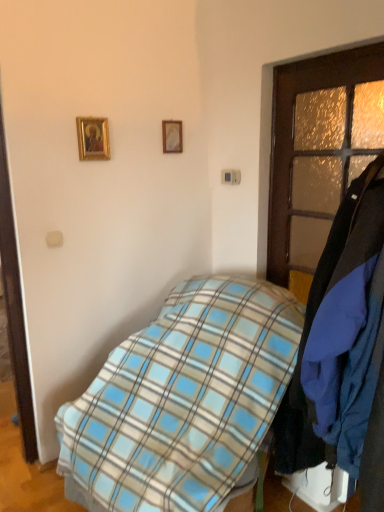
What do you see at coordinates (172, 136) in the screenshot? This screenshot has height=512, width=384. I see `gold-framed picture at upper center, the second picture frame when ordered from left to right` at bounding box center [172, 136].

What do you see at coordinates (93, 138) in the screenshot? I see `gold-framed picture at upper left, arranged as the 2th picture frame when viewed from the right` at bounding box center [93, 138].

This screenshot has height=512, width=384. I want to click on brown wooden door at right, so click(x=319, y=152).

How different are the orientations of gold-framed picture at upper center, the 2th picture frame when ordered from front to back, and brown wooden door at right in degrees?

The angular difference between gold-framed picture at upper center, the 2th picture frame when ordered from front to back, and brown wooden door at right is 91 degrees.

Is gold-framed picture at upper center, the second picture frame when ordered from left to right, inside or outside of brown wooden door at right?

gold-framed picture at upper center, the second picture frame when ordered from left to right, is spatially situated outside brown wooden door at right.

Considering the sizes of gold-framed picture at upper center, placed as the 1th picture frame when sorted from right to left, and brown wooden door at right in the image, is gold-framed picture at upper center, placed as the 1th picture frame when sorted from right to left, taller or shorter than brown wooden door at right?

gold-framed picture at upper center, placed as the 1th picture frame when sorted from right to left, is shorter than brown wooden door at right.

Which of these two, gold-framed picture at upper left, arranged as the 2th picture frame when viewed from the right, or blue plaid blanket at center, stands taller?

Standing taller between the two is blue plaid blanket at center.

Is gold-framed picture at upper left, the second picture frame positioned from the back, at the left side of blue plaid blanket at center?

Yes.

From a real-world perspective, is gold-framed picture at upper left, arranged as the 2th picture frame when viewed from the right, physically located above or below blue plaid blanket at center?

gold-framed picture at upper left, arranged as the 2th picture frame when viewed from the right, is situated higher than blue plaid blanket at center in the real world.

In the scene shown: Is the position of gold-framed picture at upper left, the first picture frame in the left-to-right sequence, less distant than that of blue plaid blanket at center?

No, it is not.

From the picture: How far apart are brown wooden door at right and gold-framed picture at upper center, which is the first picture frame in back-to-front order?

brown wooden door at right is 31.39 inches from gold-framed picture at upper center, which is the first picture frame in back-to-front order.

From a real-world perspective, who is located higher, brown wooden door at right or gold-framed picture at upper center, placed as the 1th picture frame when sorted from right to left?

gold-framed picture at upper center, placed as the 1th picture frame when sorted from right to left, is physically above.

Is brown wooden door at right not inside gold-framed picture at upper center, placed as the 1th picture frame when sorted from right to left?

Yes, brown wooden door at right is outside of gold-framed picture at upper center, placed as the 1th picture frame when sorted from right to left.

Can you confirm if brown wooden door at right is taller than gold-framed picture at upper center, which is the first picture frame in back-to-front order?

Indeed, brown wooden door at right has a greater height compared to gold-framed picture at upper center, which is the first picture frame in back-to-front order.

Is point (291, 146) more distant than point (91, 125)?

That is True.

Is brown wooden door at right turned away from gold-framed picture at upper left, the 1th picture frame from the front?

brown wooden door at right does not have its back to gold-framed picture at upper left, the 1th picture frame from the front.

Between brown wooden door at right and gold-framed picture at upper left, the first picture frame in the left-to-right sequence, which one is positioned in front?

brown wooden door at right is more forward.

Based on the photo, from the image's perspective, which is below, blue plaid blanket at center or gold-framed picture at upper center, the 2th picture frame when ordered from front to back?

From the image's view, blue plaid blanket at center is below.

Is blue plaid blanket at center facing away from gold-framed picture at upper center, which is the first picture frame in back-to-front order?

blue plaid blanket at center is not turned away from gold-framed picture at upper center, which is the first picture frame in back-to-front order.

Is blue plaid blanket at center to the left or to the right of gold-framed picture at upper center, the 2th picture frame when ordered from front to back, in the image?

blue plaid blanket at center is positioned on gold-framed picture at upper center, the 2th picture frame when ordered from front to back,'s right side.

Which of these two, blue plaid blanket at center or gold-framed picture at upper left, the first picture frame in the left-to-right sequence, is bigger?

With larger size is blue plaid blanket at center.

What's the angular difference between blue plaid blanket at center and gold-framed picture at upper left, the 1th picture frame from the front,'s facing directions?

The angular difference between blue plaid blanket at center and gold-framed picture at upper left, the 1th picture frame from the front, is 83.5 degrees.

Consider the image. Which point is more forward, (x=169, y=431) or (x=77, y=128)?

The point (x=169, y=431) is closer to the camera.

From the image's perspective, is blue plaid blanket at center located above gold-framed picture at upper left, arranged as the 2th picture frame when viewed from the right?

Incorrect, from the image's perspective, blue plaid blanket at center is lower than gold-framed picture at upper left, arranged as the 2th picture frame when viewed from the right.

Could you tell me if blue plaid blanket at center is facing brown wooden door at right?

No, blue plaid blanket at center is not aimed at brown wooden door at right.

Considering the sizes of objects blue plaid blanket at center and brown wooden door at right in the image provided, who is smaller, blue plaid blanket at center or brown wooden door at right?

With smaller size is brown wooden door at right.

From the image's perspective, which is above, blue plaid blanket at center or brown wooden door at right?

brown wooden door at right appears higher in the image.

How different are the orientations of blue plaid blanket at center and brown wooden door at right in degrees?

blue plaid blanket at center and brown wooden door at right are facing 6.42 degrees away from each other.

Identify the location of door that is in front of the gold-framed picture at upper center, placed as the 1th picture frame when sorted from right to left. (319, 152).

You are a GUI agent. You are given a task and a screenshot of the screen. Output one action in this format:
    pyautogui.click(x=<x>, y=<y>)
    Task: Click on the bed that appears below the gold-framed picture at upper left, the first picture frame in the left-to-right sequence (from the image's perspective)
    This screenshot has width=384, height=512.
    Given the screenshot: What is the action you would take?
    pyautogui.click(x=183, y=399)

When comparing their distances from gold-framed picture at upper left, the second picture frame positioned from the back, does blue plaid blanket at center or gold-framed picture at upper center, which is the first picture frame in back-to-front order, seem closer?

The object closer to gold-framed picture at upper left, the second picture frame positioned from the back, is gold-framed picture at upper center, which is the first picture frame in back-to-front order.

In the scene shown: Estimate the real-world distances between objects in this image. Which object is closer to blue plaid blanket at center, gold-framed picture at upper center, placed as the 1th picture frame when sorted from right to left, or brown wooden door at right?

The object closer to blue plaid blanket at center is brown wooden door at right.

When comparing their distances from brown wooden door at right, does gold-framed picture at upper left, arranged as the 2th picture frame when viewed from the right, or gold-framed picture at upper center, placed as the 1th picture frame when sorted from right to left, seem further?

gold-framed picture at upper left, arranged as the 2th picture frame when viewed from the right, is further to brown wooden door at right.

Looking at the image, which one is located further to gold-framed picture at upper left, the second picture frame positioned from the back, brown wooden door at right or blue plaid blanket at center?

Based on the image, blue plaid blanket at center appears to be further to gold-framed picture at upper left, the second picture frame positioned from the back.

Consider the image. Looking at the image, which one is located closer to blue plaid blanket at center, gold-framed picture at upper left, arranged as the 2th picture frame when viewed from the right, or brown wooden door at right?

brown wooden door at right is positioned closer to the anchor blue plaid blanket at center.

Looking at the image, which one is located further to gold-framed picture at upper center, the second picture frame when ordered from left to right, brown wooden door at right or gold-framed picture at upper left, the 1th picture frame from the front?

Among the two, brown wooden door at right is located further to gold-framed picture at upper center, the second picture frame when ordered from left to right.

Which object lies further to the anchor point brown wooden door at right, gold-framed picture at upper center, the second picture frame when ordered from left to right, or gold-framed picture at upper left, the 1th picture frame from the front?

Based on the image, gold-framed picture at upper left, the 1th picture frame from the front, appears to be further to brown wooden door at right.

Looking at the image, which one is located closer to gold-framed picture at upper center, the second picture frame when ordered from left to right, blue plaid blanket at center or brown wooden door at right?

brown wooden door at right is closer to gold-framed picture at upper center, the second picture frame when ordered from left to right.

Locate an element on the screen. This screenshot has width=384, height=512. door between gold-framed picture at upper left, the second picture frame positioned from the back, and blue plaid blanket at center from top to bottom is located at coordinates (319, 152).

Locate an element on the screen. The image size is (384, 512). picture frame between gold-framed picture at upper center, placed as the 1th picture frame when sorted from right to left, and blue plaid blanket at center vertically is located at coordinates (93, 138).

Find the location of a particular element. door between gold-framed picture at upper center, placed as the 1th picture frame when sorted from right to left, and blue plaid blanket at center in the up-down direction is located at coordinates (319, 152).

Image resolution: width=384 pixels, height=512 pixels. In order to click on picture frame between gold-framed picture at upper left, the first picture frame in the left-to-right sequence, and brown wooden door at right, in the horizontal direction in this screenshot , I will do `click(172, 136)`.